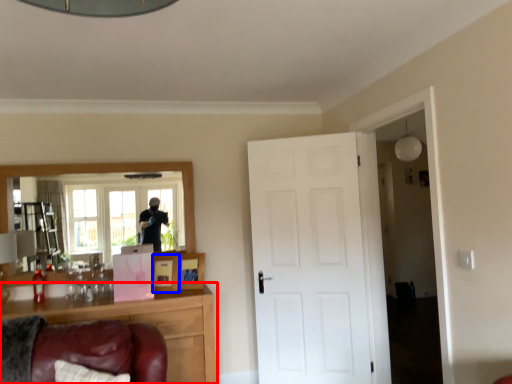
Question: Among these objects, which one is nearest to the camera, cabinetry (highlighted by a red box) or picture frame (highlighted by a blue box)?

Choices:
 (A) cabinetry
 (B) picture frame

Answer: (A)